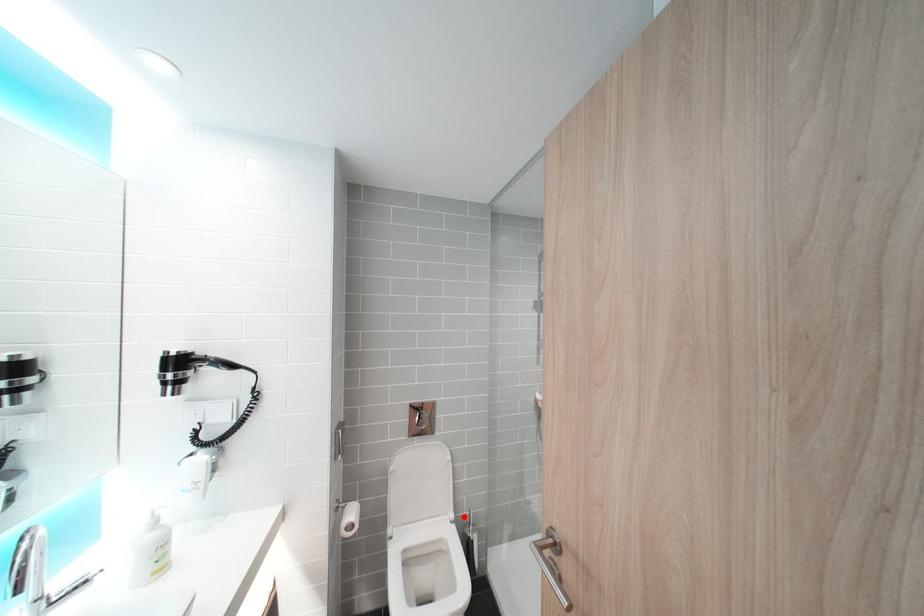
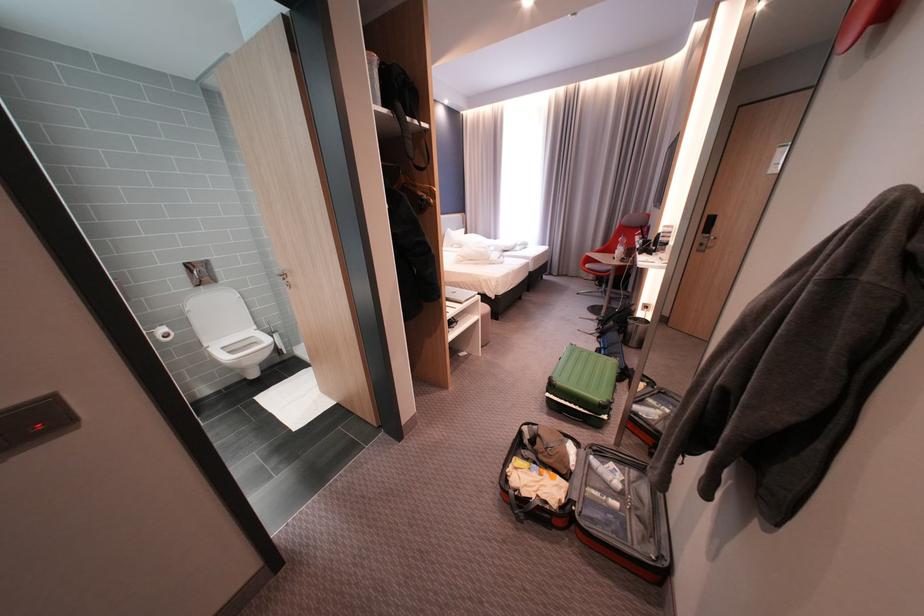
Question: I am providing you with two images of the same scene from different viewpoints. A red point is marked on the first image. Can you still see the location of the red point in image 2?

Choices:
 (A) Yes
 (B) No

Answer: (A)